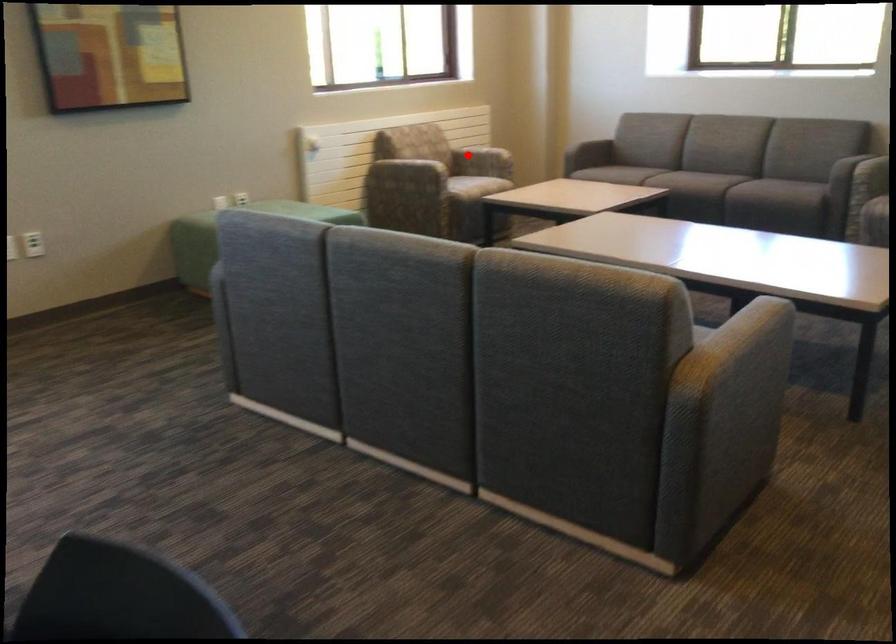
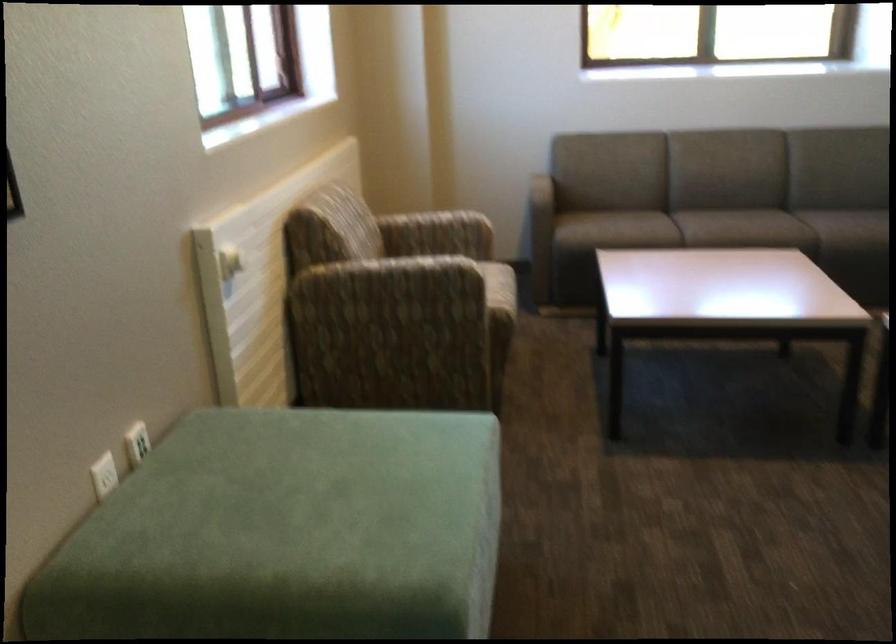
Question: I am providing you with two images of the same scene from different viewpoints. Given a red point in image1, look at the same physical point in image2. Is it:

Choices:
 (A) Closer to the viewpoint
 (B) Farther from the viewpoint

Answer: (A)